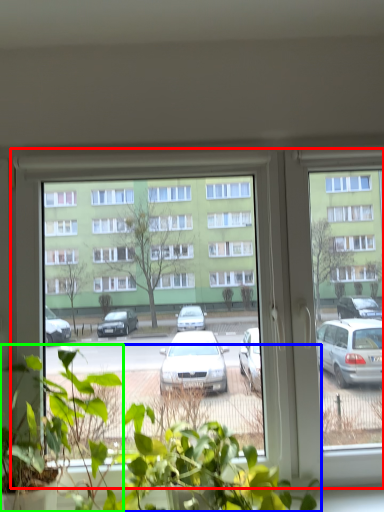
Question: Which is nearer to the window (highlighted by a red box)? houseplant (highlighted by a blue box) or houseplant (highlighted by a green box).

Choices:
 (A) houseplant
 (B) houseplant

Answer: (A)